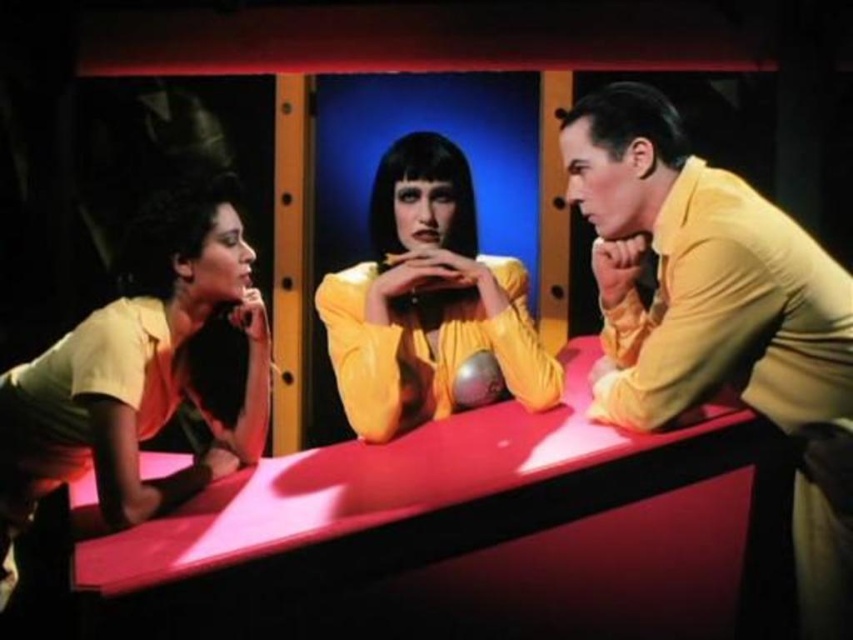
In the scene shown: Is glossy plastic table at center to the right of matte yellow blouse at center from the viewer's perspective?

In fact, glossy plastic table at center is to the left of matte yellow blouse at center.

Which is in front, point (404, 614) or point (426, 244)?

Point (404, 614) is more forward.

Which is in front, point (306, 499) or point (396, 339)?

Point (306, 499) is more forward.

Image resolution: width=853 pixels, height=640 pixels. Find the location of `glossy plastic table at center`. glossy plastic table at center is located at coordinates (469, 538).

Is point (692, 394) farther from camera compared to point (450, 365)?

No, it is in front of (450, 365).

This screenshot has height=640, width=853. What do you see at coordinates (698, 276) in the screenshot? I see `yellow smooth shirt at right` at bounding box center [698, 276].

Where is `yellow smooth shirt at right`? Image resolution: width=853 pixels, height=640 pixels. yellow smooth shirt at right is located at coordinates (698, 276).

Does glossy plastic table at center have a greater width compared to yellow smooth shirt at right?

Yes, glossy plastic table at center is wider than yellow smooth shirt at right.

Does glossy plastic table at center have a lesser width compared to yellow smooth shirt at right?

In fact, glossy plastic table at center might be wider than yellow smooth shirt at right.

Who is more forward, (282, 502) or (773, 204)?

Positioned in front is point (282, 502).

You are a GUI agent. You are given a task and a screenshot of the screen. Output one action in this format:
    pyautogui.click(x=<x>, y=<y>)
    Task: Click on the glossy plastic table at center
    The width and height of the screenshot is (853, 640).
    Given the screenshot: What is the action you would take?
    pyautogui.click(x=469, y=538)